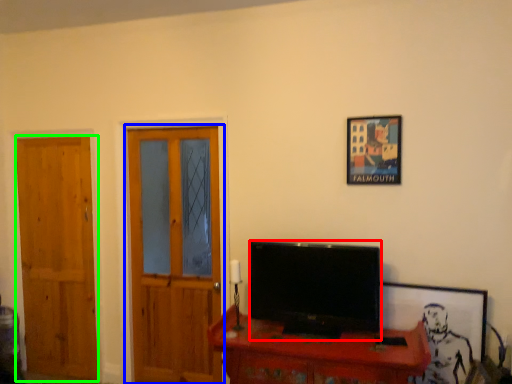
Question: Which is farther away from television (highlighted by a red box)? door (highlighted by a blue box) or door (highlighted by a green box)?

Choices:
 (A) door
 (B) door

Answer: (B)